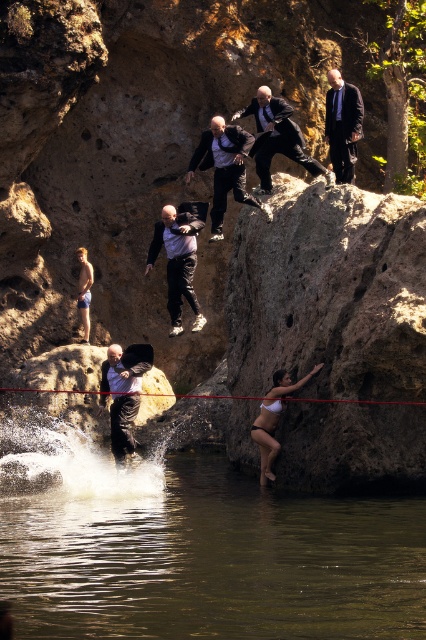
Is white matte bikini at lower center shorter than red nylon rope at lower center?

No, white matte bikini at lower center is not shorter than red nylon rope at lower center.

Is white matte bikini at lower center closer to camera compared to red nylon rope at lower center?

No.

Between point (267, 460) and point (180, 397), which one is positioned behind?

The point (180, 397) is behind.

Locate an element on the screen. The width and height of the screenshot is (426, 640). white matte bikini at lower center is located at coordinates (273, 419).

Does dark blue suit at upper center appear on the right side of smooth skin person at lower left?

Yes, dark blue suit at upper center is to the right of smooth skin person at lower left.

Who is shorter, dark blue suit at upper center or smooth skin person at lower left?

smooth skin person at lower left is shorter.

Between point (353, 141) and point (89, 320), which one is positioned in front?

Point (353, 141) is more forward.

You are a GUI agent. You are given a task and a screenshot of the screen. Output one action in this format:
    pyautogui.click(x=<x>, y=<y>)
    Task: Click on the dark blue suit at upper center
    Image resolution: width=426 pixels, height=640 pixels.
    Given the screenshot: What is the action you would take?
    pyautogui.click(x=342, y=125)

Locate an element on the screen. The image size is (426, 640). black matte pants at lower left is located at coordinates (126, 368).

Can you confirm if black matte pants at lower left is thinner than white matte bikini at lower center?

No, black matte pants at lower left is not thinner than white matte bikini at lower center.

Describe the element at coordinates (126, 368) in the screenshot. The image size is (426, 640). I see `black matte pants at lower left` at that location.

In order to click on black matte pants at lower left in this screenshot , I will do `click(126, 368)`.